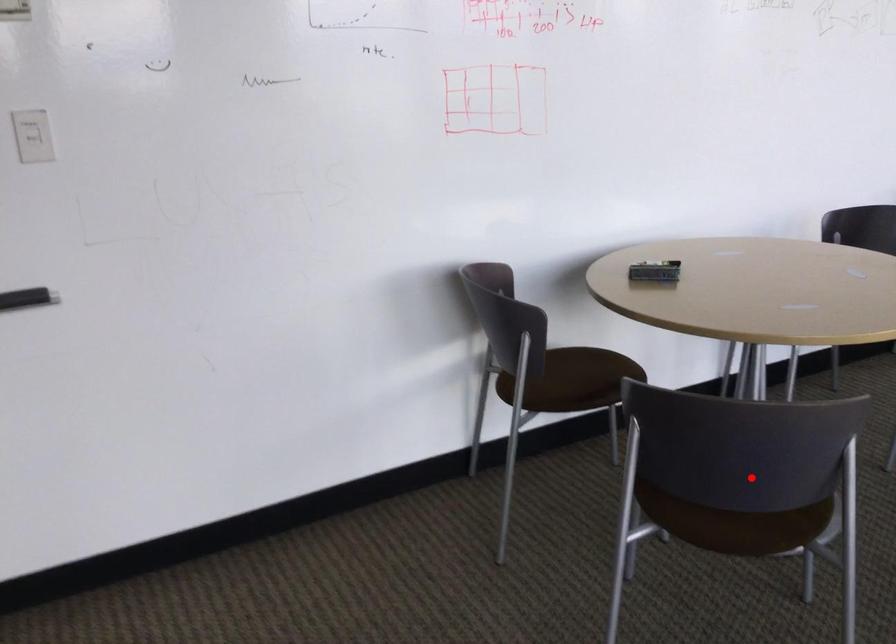
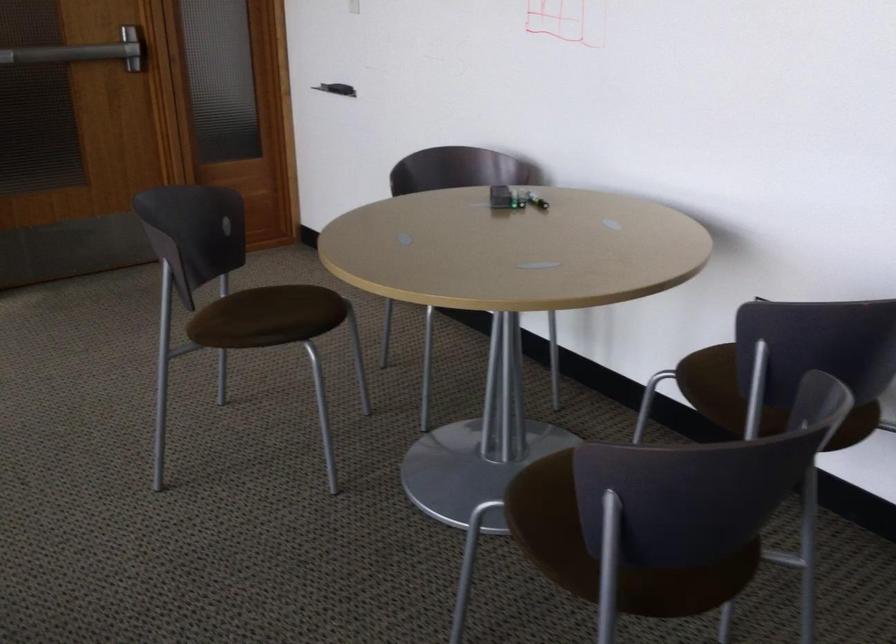
Find the pixel in the second image that matches the highlighted location in the first image.

(276, 317)